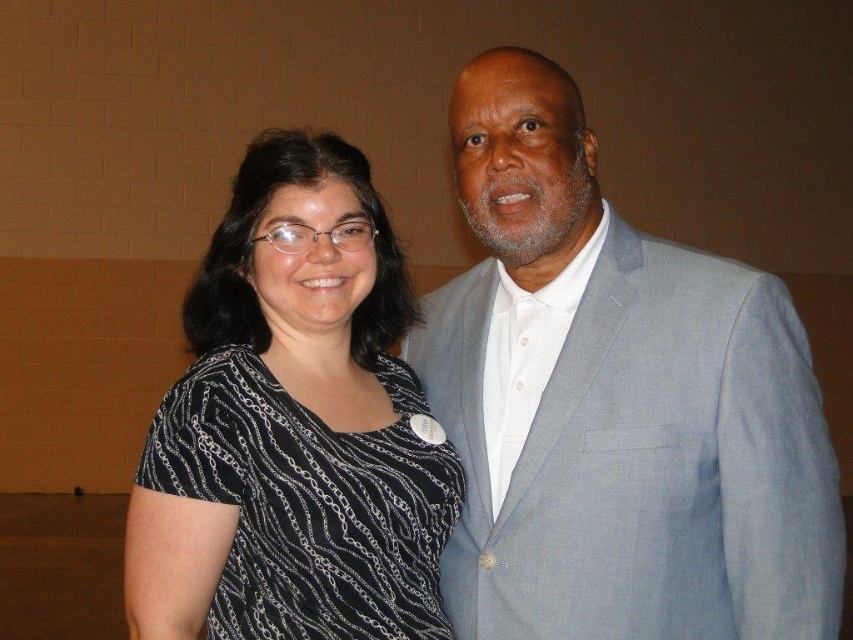
Question: Which object is farther from the camera taking this photo?

Choices:
 (A) gray textured suit at center
 (B) black printed shirt at left

Answer: (A)

Question: Which point is farther from the camera taking this photo?

Choices:
 (A) (718, 499)
 (B) (157, 480)

Answer: (A)

Question: Which of the following is the closest to the observer?

Choices:
 (A) black printed shirt at left
 (B) gray textured suit at center

Answer: (A)

Question: In this image, where is gray textured suit at center located relative to black printed shirt at left?

Choices:
 (A) right
 (B) left

Answer: (A)

Question: Does gray textured suit at center have a greater width compared to black printed shirt at left?

Choices:
 (A) yes
 (B) no

Answer: (A)

Question: Is gray textured suit at center positioned before black printed shirt at left?

Choices:
 (A) no
 (B) yes

Answer: (A)